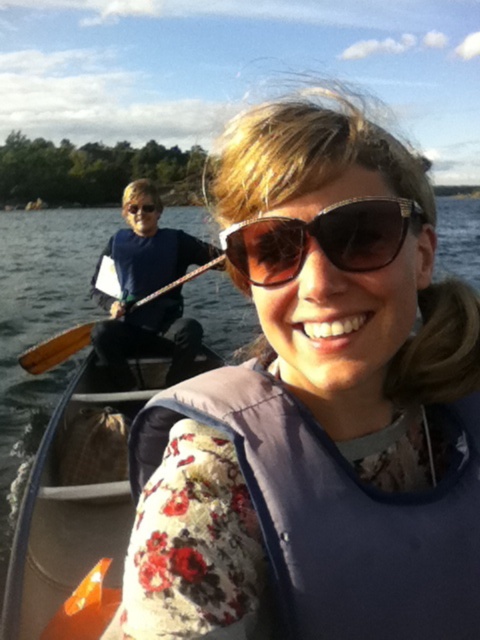
Who is lower down, matte blue life vest at center or blue fabric shirt at left?

Positioned lower is matte blue life vest at center.

In the scene shown: Is matte blue life vest at center thinner than blue fabric shirt at left?

Correct, matte blue life vest at center's width is less than blue fabric shirt at left's.

Is point (183, 406) farther from camera compared to point (133, 316)?

No, (183, 406) is in front of (133, 316).

Find the location of a particular element. This screenshot has height=640, width=480. matte blue life vest at center is located at coordinates (316, 406).

Who is shorter, sunglasses at center or brown wooden paddle at left?

sunglasses at center

The width and height of the screenshot is (480, 640). Find the location of `sunglasses at center`. sunglasses at center is located at coordinates (321, 237).

The image size is (480, 640). I want to click on sunglasses at center, so click(321, 237).

Is point (288, 493) positioned after point (261, 256)?

Yes.

Does matte blue life vest at center have a lesser height compared to sunglasses at center?

In fact, matte blue life vest at center may be taller than sunglasses at center.

Which is behind, point (477, 300) or point (370, 237)?

Point (477, 300)

The width and height of the screenshot is (480, 640). Identify the location of matte blue life vest at center. (316, 406).